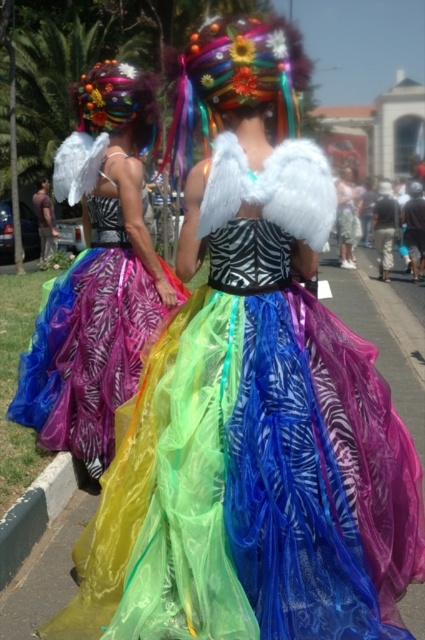
Question: Based on their relative distances, which object is farther from the shiny multicolored dress at center?

Choices:
 (A) green rubber curb at lower left
 (B) matte white wings at center

Answer: (B)

Question: Is shiny multicolored dress at center positioned before green rubber curb at lower left?

Choices:
 (A) yes
 (B) no

Answer: (B)

Question: Can you confirm if shiny multicolored dress at center is smaller than matte white wings at center?

Choices:
 (A) no
 (B) yes

Answer: (B)

Question: Is shiny multicolored dress at center above matte white wings at center?

Choices:
 (A) no
 (B) yes

Answer: (A)

Question: Which point appears closest to the camera in this image?

Choices:
 (A) (73, 465)
 (B) (348, 253)
 (C) (127, 381)
 (D) (138, 420)

Answer: (D)

Question: Which is nearer to the shiny multicolored dress at center?

Choices:
 (A) green rubber curb at lower left
 (B) matte white wings at center

Answer: (A)